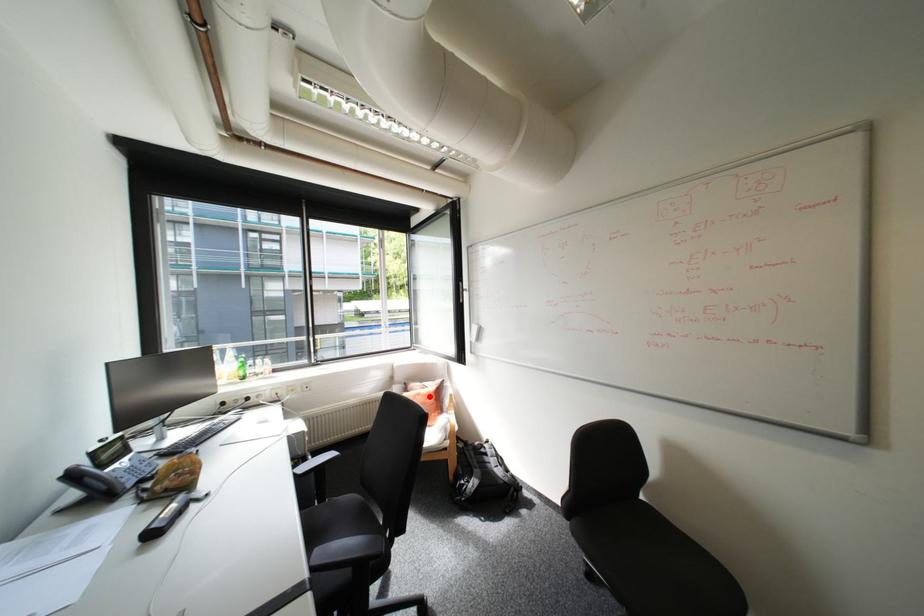
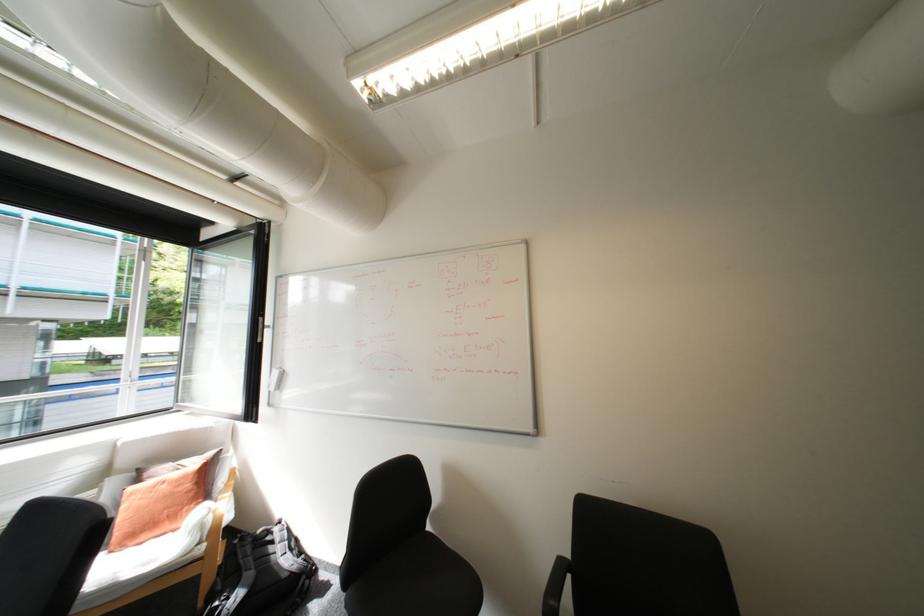
The point at the highlighted location is marked in the first image. Where is the corresponding point in the second image?

(175, 485)